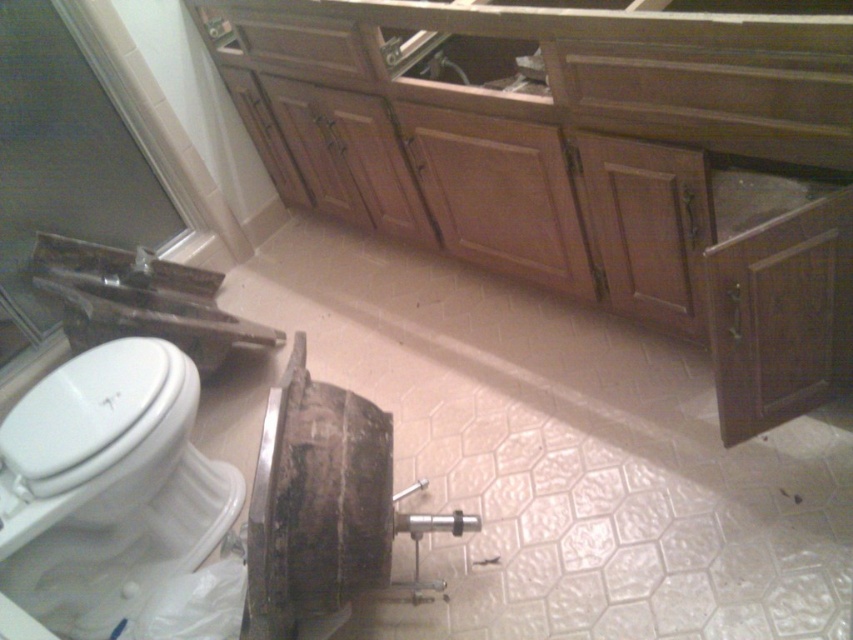
Question: Is white glossy toilet bowl at lower left further to the viewer compared to metallic silver sink at left?

Choices:
 (A) no
 (B) yes

Answer: (A)

Question: Which point is closer to the camera?

Choices:
 (A) (48, 396)
 (B) (213, 310)
 (C) (653, 10)

Answer: (C)

Question: Considering the real-world distances, which object is farthest from the metallic silver sink at left?

Choices:
 (A) wooden cabinet at center
 (B) white glossy toilet bowl at lower left

Answer: (A)

Question: Observing the image, what is the correct spatial positioning of wooden cabinet at center in reference to white glossy toilet bowl at lower left?

Choices:
 (A) left
 (B) right

Answer: (B)

Question: Considering the real-world distances, which object is farthest from the metallic silver sink at left?

Choices:
 (A) white glossy toilet bowl at lower left
 (B) wooden cabinet at center

Answer: (B)

Question: Is wooden cabinet at center wider than white glossy toilet bowl at lower left?

Choices:
 (A) yes
 (B) no

Answer: (A)